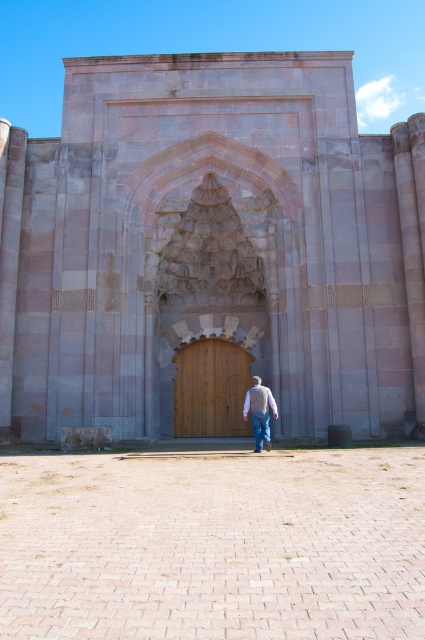
Can you confirm if light brown sweater at center is wider than blue denim jeans at center?

Yes, light brown sweater at center is wider than blue denim jeans at center.

Between light brown sweater at center and blue denim jeans at center, which one is positioned lower?

blue denim jeans at center is lower down.

This screenshot has width=425, height=640. I want to click on light brown sweater at center, so click(260, 412).

Who is more forward, (206,381) or (261,420)?

Point (261,420) is more forward.

Does wooden door at center appear under blue denim jeans at center?

Actually, wooden door at center is above blue denim jeans at center.

Who is more forward, [210,412] or [263,419]?

Positioned in front is point [263,419].

The width and height of the screenshot is (425, 640). Find the location of `wooden door at center`. wooden door at center is located at coordinates (210, 388).

Is wooden door at center above light brown sweater at center?

Indeed, wooden door at center is positioned over light brown sweater at center.

Does wooden door at center have a lesser height compared to light brown sweater at center?

No, wooden door at center is not shorter than light brown sweater at center.

Is point (243, 428) farther from camera compared to point (263, 428)?

Yes, point (243, 428) is behind point (263, 428).

Where is `wooden door at center`? The height and width of the screenshot is (640, 425). wooden door at center is located at coordinates (210, 388).